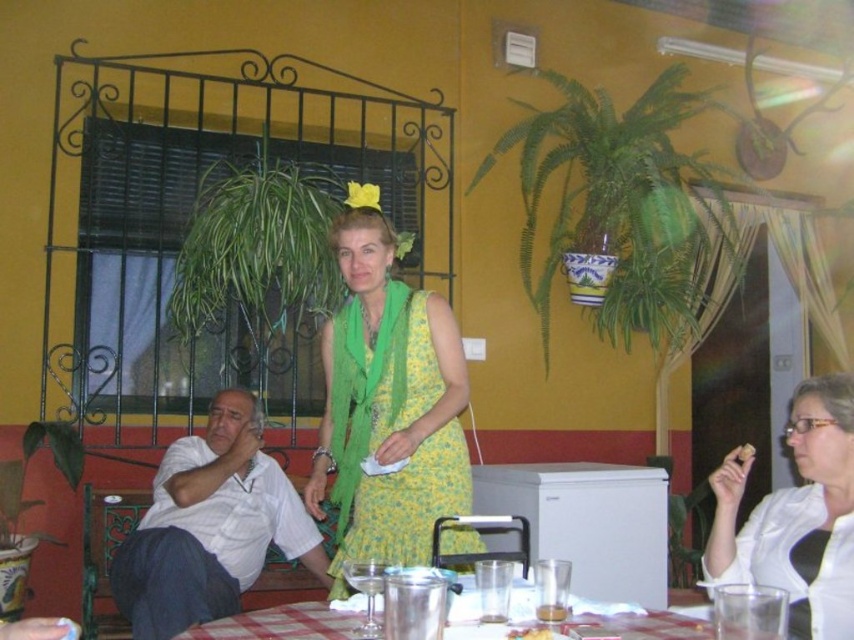
Question: Which object is positioned farthest from the checkered fabric table at lower center?

Choices:
 (A) crumbly golden cookie at lower right
 (B) yellow floral dress at center
 (C) white cotton shirt at center

Answer: (C)

Question: Which object appears farthest from the camera in this image?

Choices:
 (A) crumbly golden cookie at lower right
 (B) white crumb at upper right
 (C) checkered fabric table at lower center
 (D) white glossy shirt at lower right

Answer: (B)

Question: Considering the relative positions of white glossy shirt at lower right and white crumb at upper right in the image provided, where is white glossy shirt at lower right located with respect to white crumb at upper right?

Choices:
 (A) below
 (B) above

Answer: (B)

Question: Among these objects, which one is nearest to the camera?

Choices:
 (A) white crumb at upper right
 (B) yellow floral dress at center
 (C) white glossy shirt at lower right

Answer: (C)

Question: Is white glossy shirt at lower right to the right of crumbly golden cookie at lower right from the viewer's perspective?

Choices:
 (A) no
 (B) yes

Answer: (B)

Question: Can you confirm if white cotton shirt at center is positioned above checkered fabric table at lower center?

Choices:
 (A) no
 (B) yes

Answer: (A)